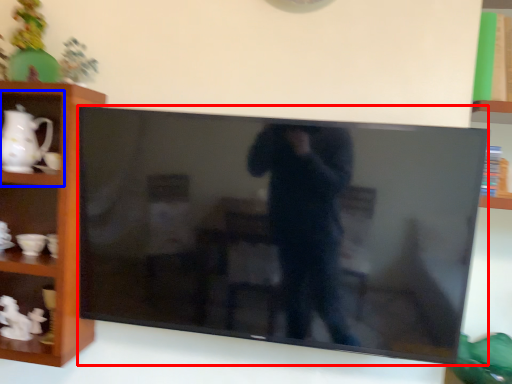
Question: Among these objects, which one is nearest to the camera, television (highlighted by a red box) or cabinet (highlighted by a blue box)?

Choices:
 (A) television
 (B) cabinet

Answer: (A)